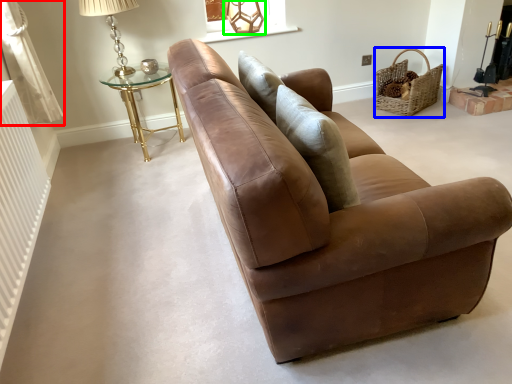
Question: Which object is positioned farthest from curtain (highlighted by a red box)? Select from basket (highlighted by a blue box) and table lamp (highlighted by a green box).

Choices:
 (A) basket
 (B) table lamp

Answer: (A)